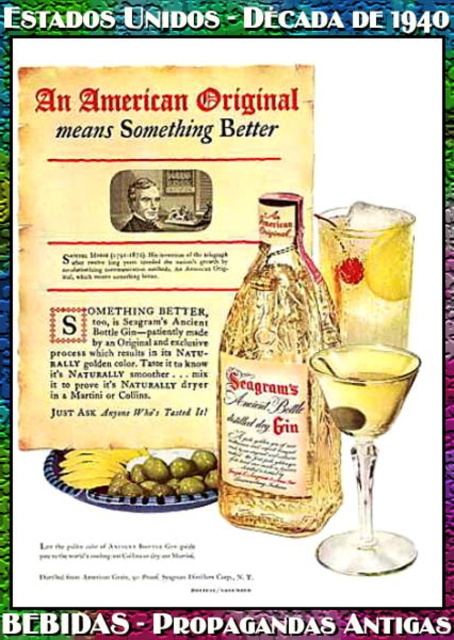
Who is positioned more to the right, clear glass drink at center right or yellow liquid at center?

clear glass drink at center right is more to the right.

Where is `clear glass drink at center right`? The image size is (454, 640). clear glass drink at center right is located at coordinates (369, 269).

Who is positioned more to the left, transparent glass martini glass at center or green matte olives at lower center?

green matte olives at lower center

Is transparent glass martini glass at center below green matte olives at lower center?

No, transparent glass martini glass at center is not below green matte olives at lower center.

Is point (316, 358) behind point (141, 464)?

That is False.

You are a GUI agent. You are given a task and a screenshot of the screen. Output one action in this format:
    pyautogui.click(x=<x>, y=<y>)
    Task: Click on the transparent glass martini glass at center
    
    Given the screenshot: What is the action you would take?
    pyautogui.click(x=365, y=445)

Between transparent glass martini glass at center and yellow liquid at center, which one is positioned lower?

Positioned lower is transparent glass martini glass at center.

Does transparent glass martini glass at center have a lesser height compared to yellow liquid at center?

In fact, transparent glass martini glass at center may be taller than yellow liquid at center.

Is point (374, 570) behind point (345, 378)?

No, it is in front of (345, 378).

Locate an element on the screen. transparent glass martini glass at center is located at coordinates (365, 445).